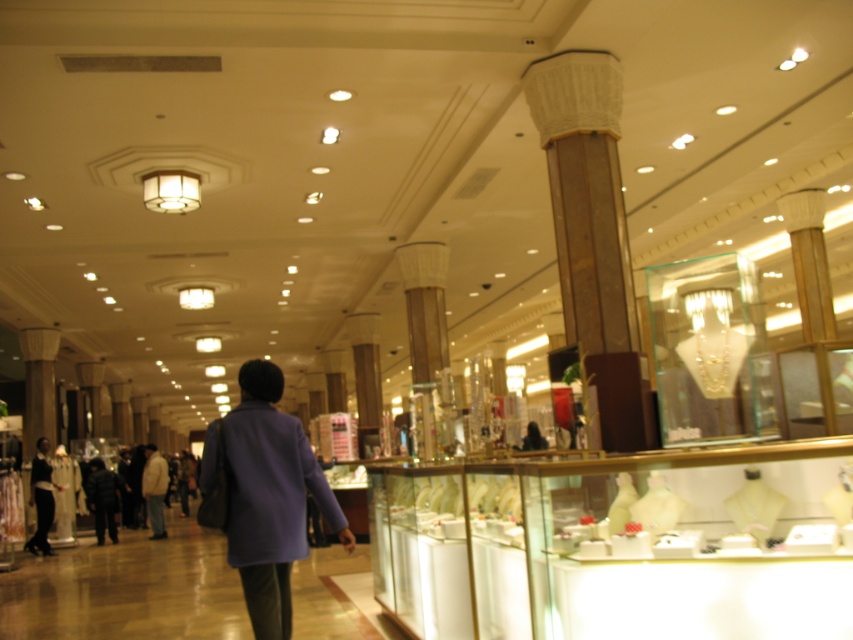
Question: Which point is farther from the camera taking this photo?

Choices:
 (A) (155, 464)
 (B) (258, 378)
 (C) (42, 467)

Answer: (A)

Question: Among these points, which one is farthest from the camera?

Choices:
 (A) (39, 499)
 (B) (149, 518)
 (C) (248, 470)

Answer: (B)

Question: Does purple fabric coat at center have a smaller size compared to dark blue coat at center?

Choices:
 (A) yes
 (B) no

Answer: (A)

Question: Is dark blue coat at center thinner than light beige jacket at center?

Choices:
 (A) no
 (B) yes

Answer: (A)

Question: Which of these objects is positioned closest to the light beige jacket at center?

Choices:
 (A) purple fabric coat at center
 (B) dark blue coat at center

Answer: (B)

Question: Is dark blue coat at center below light beige jacket at center?

Choices:
 (A) no
 (B) yes

Answer: (A)